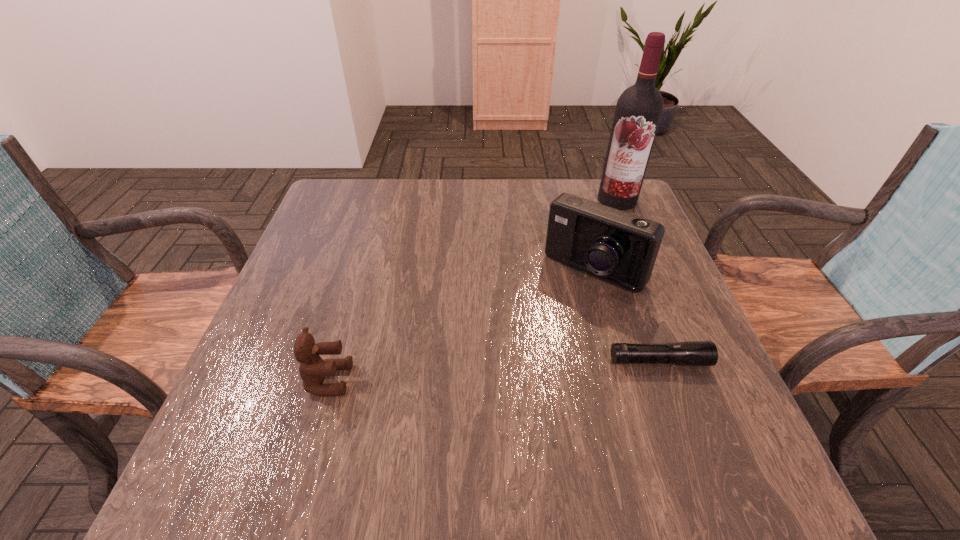
Find the location of a particular element. The height and width of the screenshot is (540, 960). free space between the flashlight and the second farthest object is located at coordinates (627, 315).

In order to click on empty space that is in between the camera and the flashlight in this screenshot , I will do `click(627, 315)`.

At what (x,y) coordinates should I click in order to perform the action: click on vacant space that is in between the shortest object and the teddy bear. Please return your answer as a coordinate pair (x, y). The height and width of the screenshot is (540, 960). Looking at the image, I should click on (494, 370).

Locate an element on the screen. unoccupied position between the leftmost object and the flashlight is located at coordinates (494, 370).

This screenshot has height=540, width=960. I want to click on vacant area between the third tallest object and the shortest object, so click(x=494, y=370).

Identify which object is the third nearest to the tallest object. Please provide its 2D coordinates. Your answer should be formatted as a tuple, i.e. [(x, y)], where the tuple contains the x and y coordinates of a point satisfying the conditions above.

[(313, 369)]

Choose which object is the second nearest neighbor to the shortest object. Please provide its 2D coordinates. Your answer should be formatted as a tuple, i.e. [(x, y)], where the tuple contains the x and y coordinates of a point satisfying the conditions above.

[(639, 108)]

This screenshot has width=960, height=540. Find the location of `free location that satisfies the following two spatial constraints: 1. on the back side of the farthest object; 2. on the right side of the third nearest object`. free location that satisfies the following two spatial constraints: 1. on the back side of the farthest object; 2. on the right side of the third nearest object is located at coordinates [574, 200].